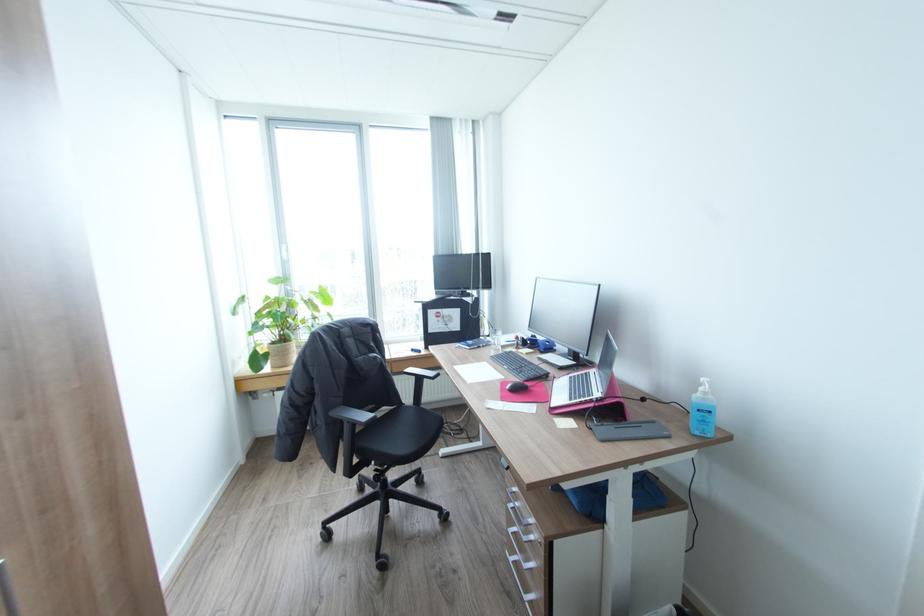
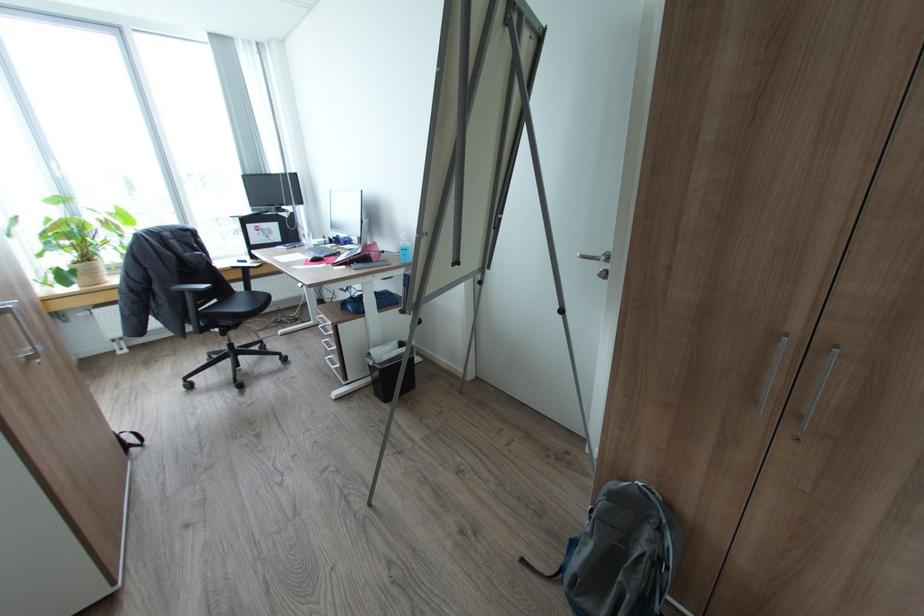
In the second image, find the point that corresponds to the point at 709,421 in the first image.

(408, 254)